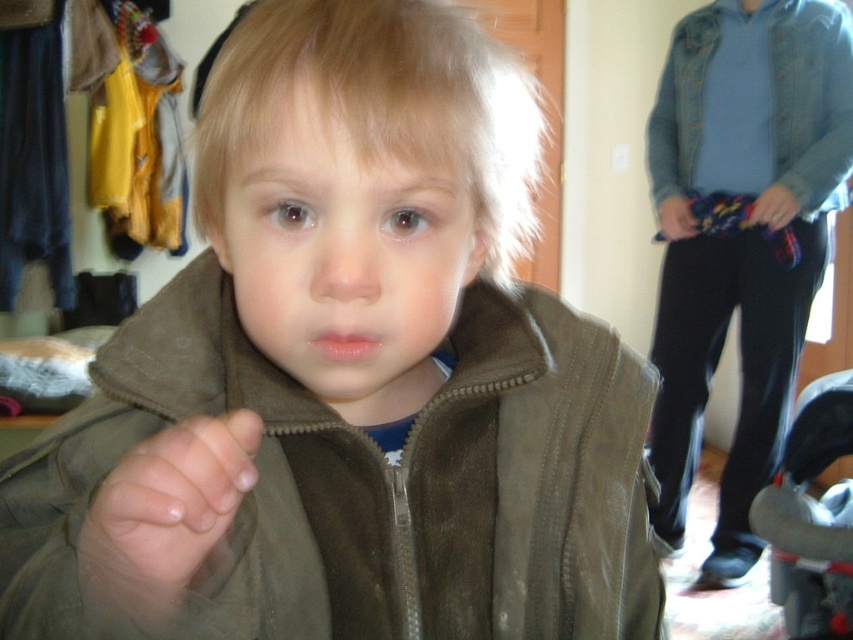
Question: Does smooth skin hand at center come behind black plastic baby carriage at lower right?

Choices:
 (A) yes
 (B) no

Answer: (B)

Question: Which object appears closest to the camera in this image?

Choices:
 (A) brown suede jacket at upper right
 (B) smooth skin hand at center
 (C) black plastic baby carriage at lower right

Answer: (B)

Question: Which point is farther from the camera taking this photo?

Choices:
 (A) (788, 461)
 (B) (717, 237)

Answer: (B)

Question: Can you confirm if brown suede jacket at upper right is positioned above black plastic baby carriage at lower right?

Choices:
 (A) yes
 (B) no

Answer: (A)

Question: In this image, where is brown suede jacket at upper right located relative to black plastic baby carriage at lower right?

Choices:
 (A) right
 (B) left

Answer: (B)

Question: Which object appears closest to the camera in this image?

Choices:
 (A) smooth skin hand at center
 (B) black plastic baby carriage at lower right
 (C) brown suede jacket at upper right

Answer: (A)